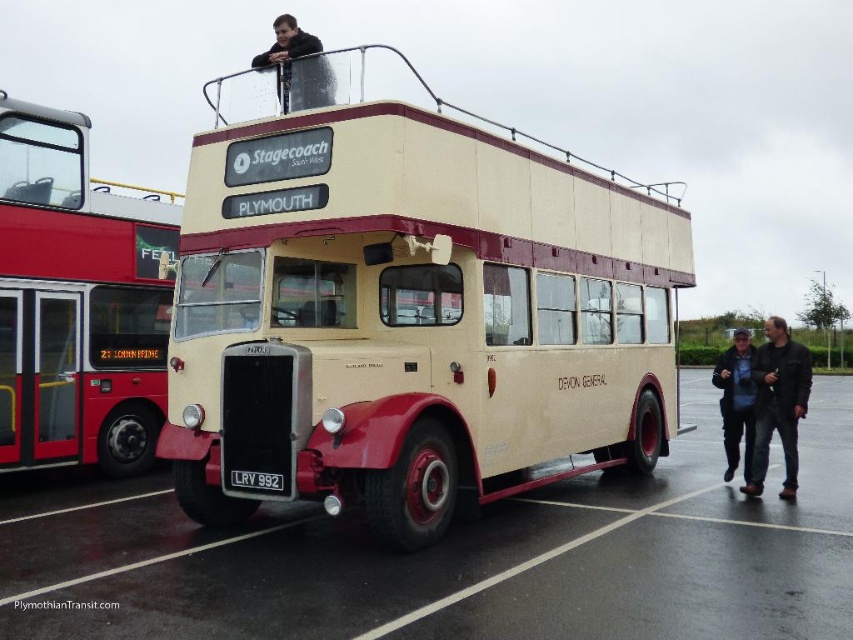
Question: Can you confirm if beige matte bus at center is bigger than black leather jacket at upper center?

Choices:
 (A) yes
 (B) no

Answer: (A)

Question: Which point is closer to the camera?

Choices:
 (A) black leather jacket at upper center
 (B) black metal license plate at center
 (C) beige rubber parking lot at center
 (D) red metallic bus at left

Answer: (C)

Question: Is black leather jacket at lower right in front of black leather jacket at upper center?

Choices:
 (A) yes
 (B) no

Answer: (B)

Question: Which point is farther to the camera?

Choices:
 (A) (274, 488)
 (B) (724, 424)

Answer: (B)

Question: Does dark blue jacket at lower right appear over black metal license plate at center?

Choices:
 (A) yes
 (B) no

Answer: (A)

Question: Which of the following is the closest to the observer?

Choices:
 (A) black leather jacket at lower right
 (B) black leather jacket at upper center

Answer: (B)